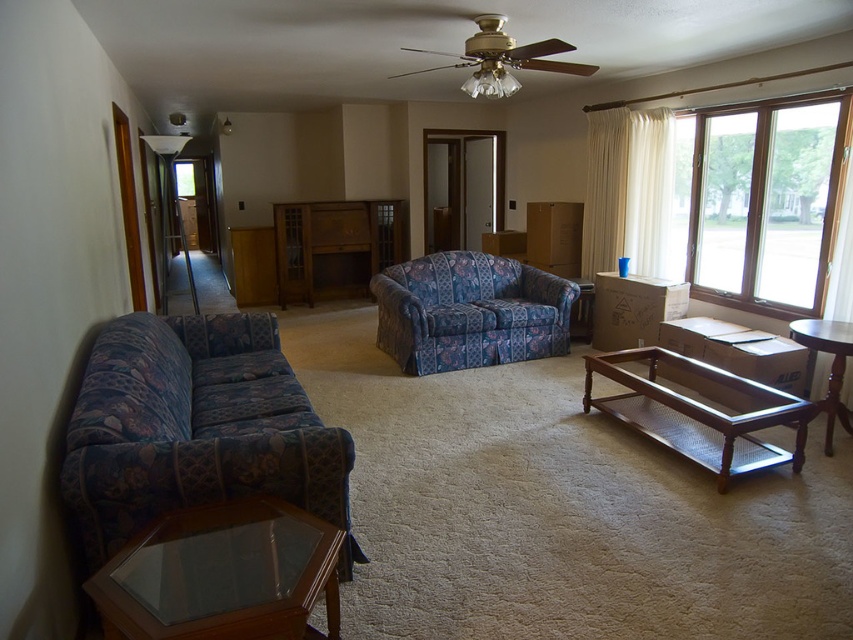
Between point (250, 321) and point (589, 301), which one is positioned behind?

Point (589, 301)

Is floral fabric couch at left above clear glass coffee table at center?

No.

Between point (117, 337) and point (579, 292), which one is positioned in front?

Point (117, 337) is more forward.

Image resolution: width=853 pixels, height=640 pixels. Find the location of `floral fabric couch at left`. floral fabric couch at left is located at coordinates (195, 429).

Based on the photo, between floral fabric couch at center and brown wooden table at lower right, which one appears on the right side from the viewer's perspective?

brown wooden table at lower right

Which of these two, floral fabric couch at center or brown wooden table at lower right, stands shorter?

brown wooden table at lower right is shorter.

Which is behind, point (373, 288) or point (840, 332)?

Point (373, 288)

The image size is (853, 640). Find the location of `floral fabric couch at center`. floral fabric couch at center is located at coordinates click(x=469, y=310).

Is brown wood/metal mesh coffee table at center to the left of brown wooden table at lower right from the viewer's perspective?

Indeed, brown wood/metal mesh coffee table at center is positioned on the left side of brown wooden table at lower right.

Is point (715, 429) positioned after point (831, 436)?

Yes, it is behind point (831, 436).

The image size is (853, 640). In order to click on brown wood/metal mesh coffee table at center in this screenshot , I will do `click(698, 413)`.

This screenshot has height=640, width=853. Identify the location of brown wood/metal mesh coffee table at center. (698, 413).